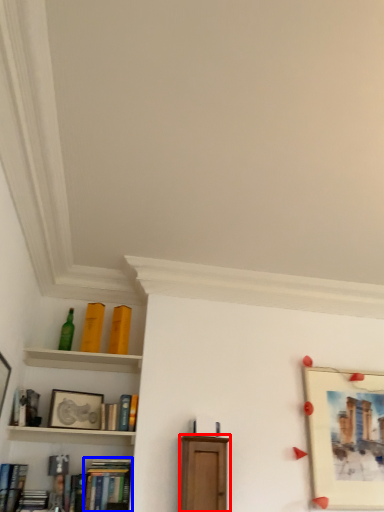
Question: Which of the following is the farthest to the observer, furniture (highlighted by a red box) or book (highlighted by a blue box)?

Choices:
 (A) furniture
 (B) book

Answer: (B)